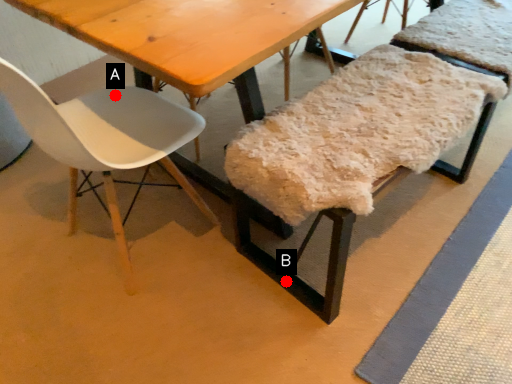
Question: Two points are circled on the image, labeled by A and B beside each circle. Which point is further to the camera?

Choices:
 (A) A is further
 (B) B is further

Answer: (A)